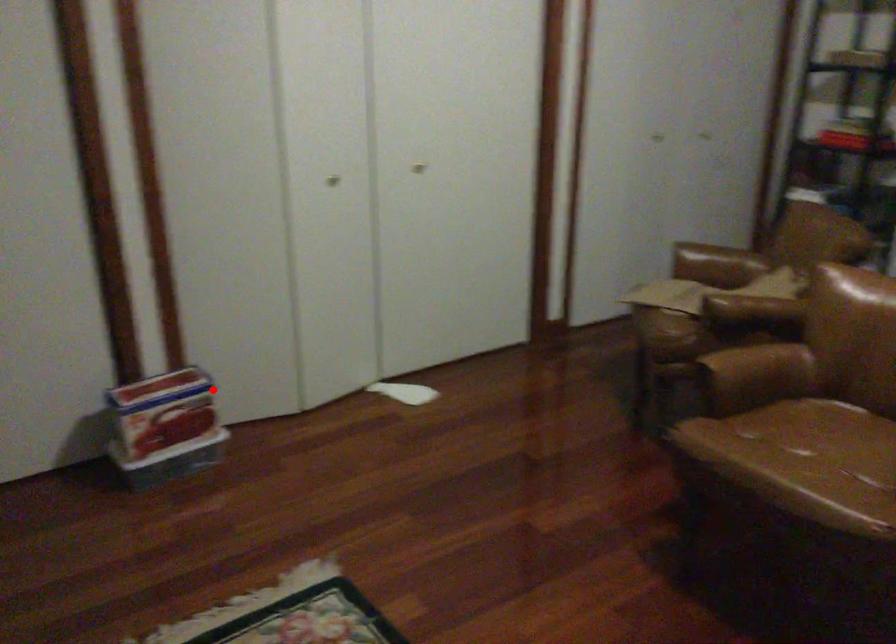
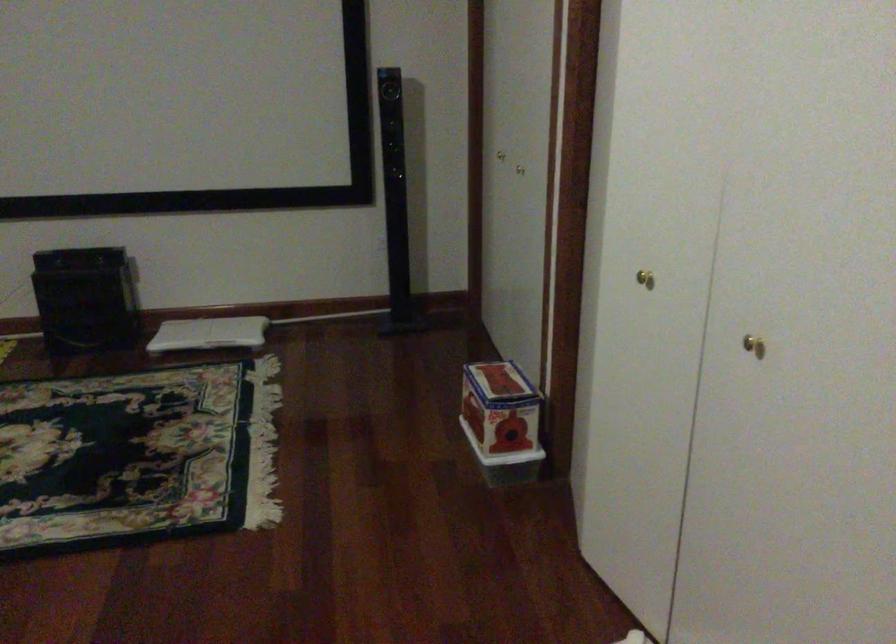
Find the pixel in the second image that matches the highlighted location in the first image.

(501, 422)